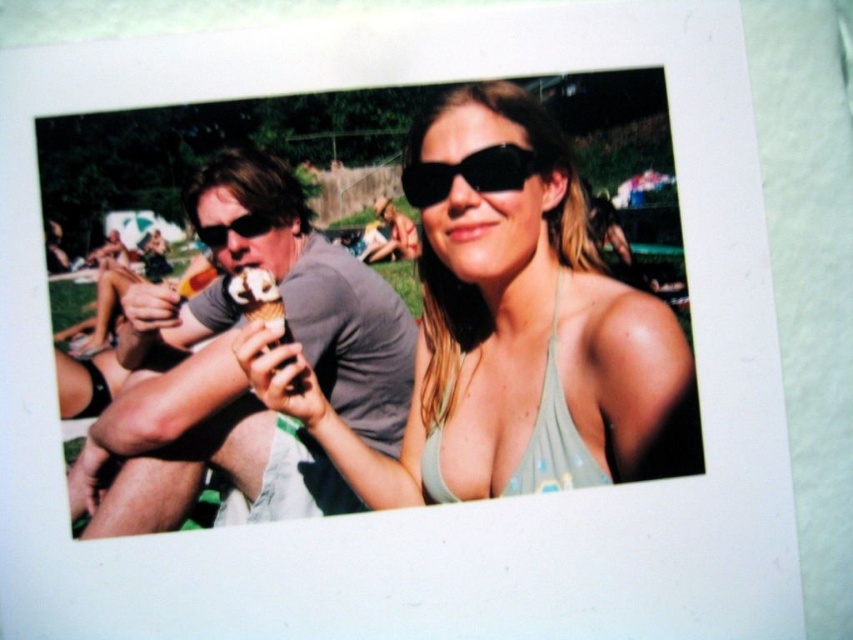
Question: Among these objects, which one is farthest from the camera?

Choices:
 (A) vanilla ice cream cone at center
 (B) matte gray t-shirt at left
 (C) matte gray tank top at center

Answer: (A)

Question: Among these objects, which one is farthest from the camera?

Choices:
 (A) matte black sunglasses at center
 (B) light blue fabric bikini top at upper right
 (C) black plastic sunglasses at upper right

Answer: (A)

Question: Which object is positioned closest to the matte gray tank top at center?

Choices:
 (A) black plastic sunglasses at upper right
 (B) light blue fabric bikini top at upper right
 (C) vanilla ice cream cone at center

Answer: (B)

Question: Does matte gray tank top at center come behind matte gray t-shirt at left?

Choices:
 (A) yes
 (B) no

Answer: (A)

Question: Considering the relative positions of matte gray tank top at center and light blue fabric bikini top at upper right in the image provided, where is matte gray tank top at center located with respect to light blue fabric bikini top at upper right?

Choices:
 (A) below
 (B) above

Answer: (B)

Question: Is matte gray tank top at center bigger than vanilla ice cream cone at center?

Choices:
 (A) yes
 (B) no

Answer: (A)